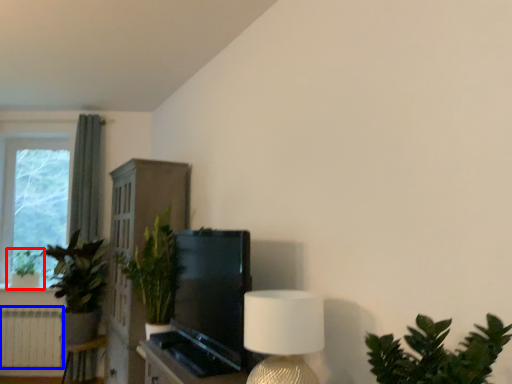
Question: Which point is closer to the camera, houseplant (highlighted by a red box) or radiator (highlighted by a blue box)?

Choices:
 (A) houseplant
 (B) radiator

Answer: (B)